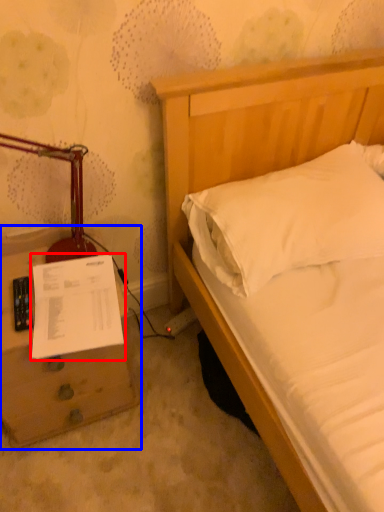
Question: Which object appears farthest to the camera in this image, document (highlighted by a red box) or nightstand (highlighted by a blue box)?

Choices:
 (A) document
 (B) nightstand

Answer: (A)